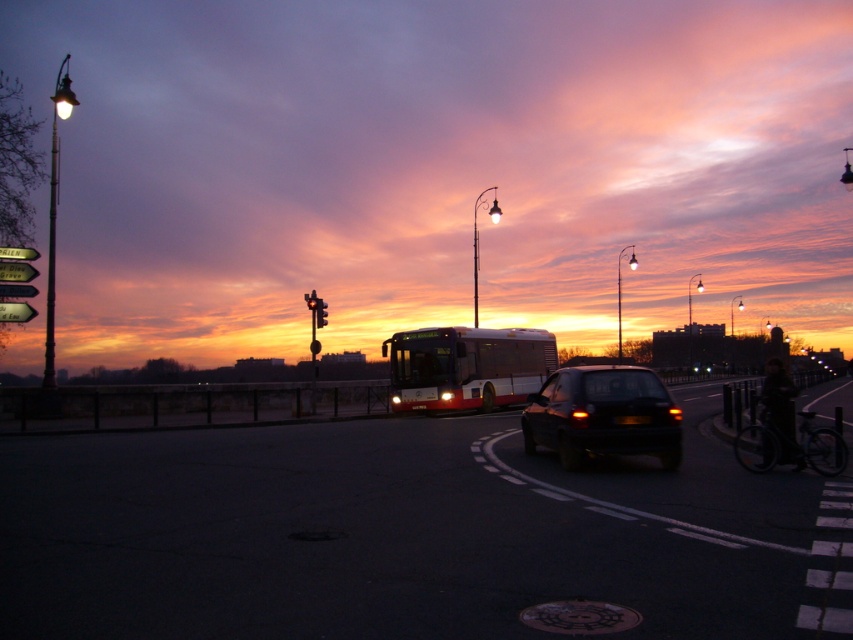
Question: Where is red metallic bus at center located in relation to red glass traffic light at upper center in the image?

Choices:
 (A) right
 (B) left

Answer: (A)

Question: Which object appears closest to the camera in this image?

Choices:
 (A) shiny black car at center
 (B) red metallic bus at center
 (C) metallic bus at center

Answer: (A)

Question: Is shiny black car at center smaller than red metallic bus at center?

Choices:
 (A) no
 (B) yes

Answer: (B)

Question: Which point is farther from the camera taking this photo?

Choices:
 (A) (381, 228)
 (B) (573, 426)
 (C) (502, 371)
 (D) (320, 300)

Answer: (A)

Question: Is metallic bus at center smaller than red glass traffic light at upper center?

Choices:
 (A) yes
 (B) no

Answer: (B)

Question: Which point appears farthest from the camera in this image?

Choices:
 (A) (477, 332)
 (B) (804, 22)
 (C) (657, 419)

Answer: (B)